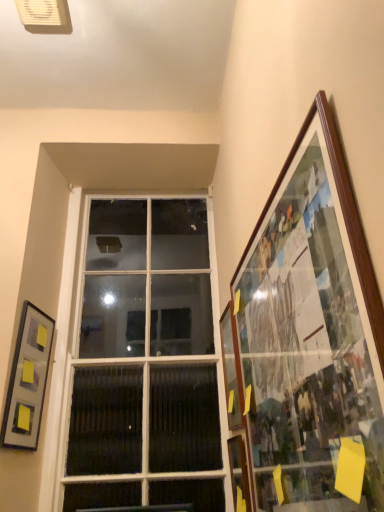
Locate an element on the screen. empty space that is ontop of white glass window at center (from a real-world perspective) is located at coordinates (155, 190).